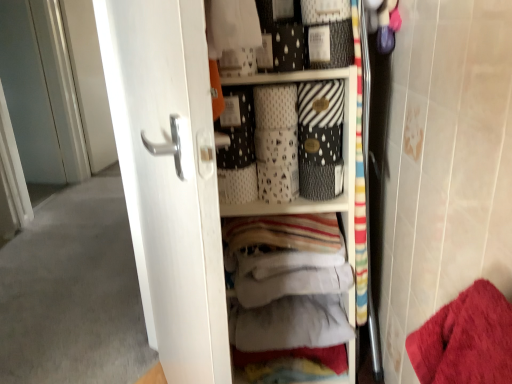
Question: Is white matte baskets at upper center completely or partially outside of white glossy door at left, the second screen door from the right?

Choices:
 (A) no
 (B) yes

Answer: (B)

Question: Can you confirm if white matte baskets at upper center is thinner than white glossy door at left, which is the 2th screen door in front-to-back order?

Choices:
 (A) no
 (B) yes

Answer: (A)

Question: Is the depth of white matte baskets at upper center greater than that of white glossy door at left, which is the 1th screen door in left-to-right order?

Choices:
 (A) no
 (B) yes

Answer: (A)

Question: Is white matte baskets at upper center bigger than white glossy door at left, which ranks as the first screen door in back-to-front order?

Choices:
 (A) yes
 (B) no

Answer: (B)

Question: Is white matte baskets at upper center far away from white glossy door at left, which is the 2th screen door in front-to-back order?

Choices:
 (A) no
 (B) yes

Answer: (B)

Question: Does white matte baskets at upper center touch white glossy door at left, which is the 1th screen door in left-to-right order?

Choices:
 (A) no
 (B) yes

Answer: (A)

Question: Is white glossy door at center, the 2th screen door viewed from the left, looking in the opposite direction of white glossy door at left, the second screen door from the right?

Choices:
 (A) no
 (B) yes

Answer: (A)

Question: From the image's perspective, does white glossy door at center, which is the 1th screen door from right to left, appear lower than white glossy door at left, which is the 2th screen door in front-to-back order?

Choices:
 (A) no
 (B) yes

Answer: (B)

Question: Considering the relative sizes of white glossy door at center, the second screen door positioned from the back, and white glossy door at left, which is the 2th screen door in front-to-back order, in the image provided, is white glossy door at center, the second screen door positioned from the back, thinner than white glossy door at left, which is the 2th screen door in front-to-back order,?

Choices:
 (A) no
 (B) yes

Answer: (A)

Question: Are white glossy door at center, the first screen door viewed from the front, and white glossy door at left, which is the 1th screen door in left-to-right order, far apart?

Choices:
 (A) yes
 (B) no

Answer: (A)

Question: From a real-world perspective, is white glossy door at center, the 2th screen door viewed from the left, located higher than white glossy door at left, which ranks as the first screen door in back-to-front order?

Choices:
 (A) yes
 (B) no

Answer: (B)

Question: Is white glossy door at center, which is the 1th screen door from right to left, next to white glossy door at left, which ranks as the first screen door in back-to-front order, and touching it?

Choices:
 (A) no
 (B) yes

Answer: (A)

Question: Considering the relative positions of white matte baskets at upper center and white glossy door at center, which is the 1th screen door from right to left, in the image provided, is white matte baskets at upper center to the right of white glossy door at center, which is the 1th screen door from right to left, from the viewer's perspective?

Choices:
 (A) no
 (B) yes

Answer: (B)